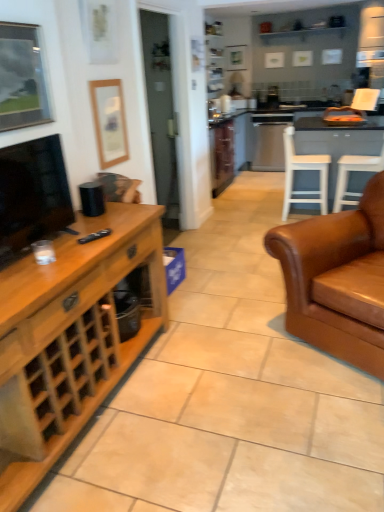
Find the location of a particular element. This screenshot has height=512, width=384. vacant space that's between matte black tv at left and black matte remote at center is located at coordinates (81, 241).